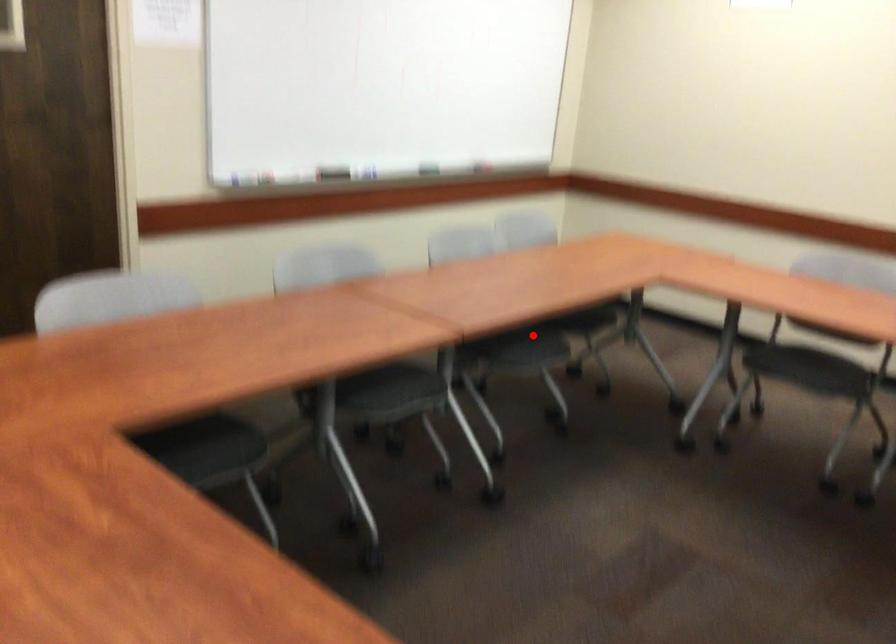
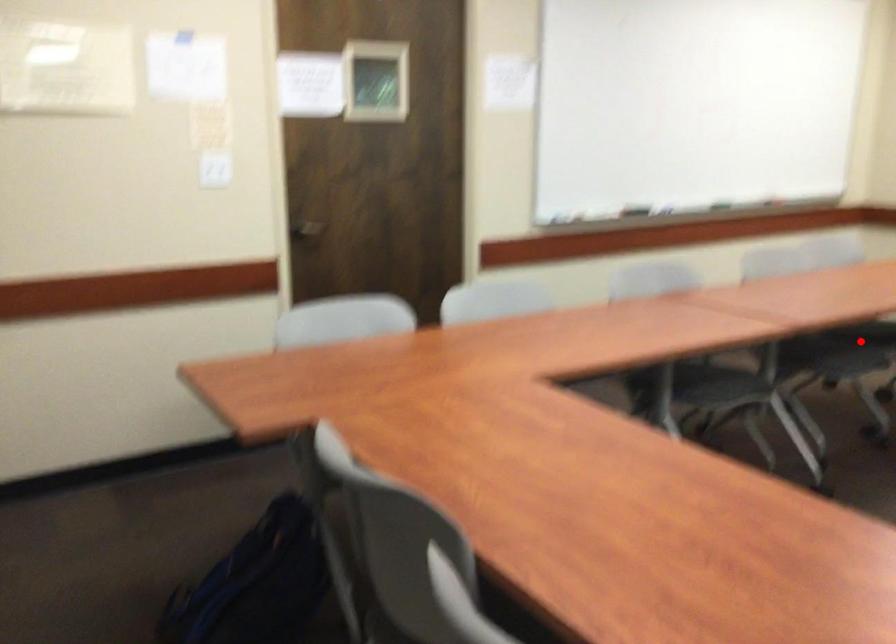
I am providing you with two images of the same scene from different viewpoints. A red point is marked on the first image and another point is marked on the second image. Are the points marked in image1 and image2 representing the same 3D position?

Yes